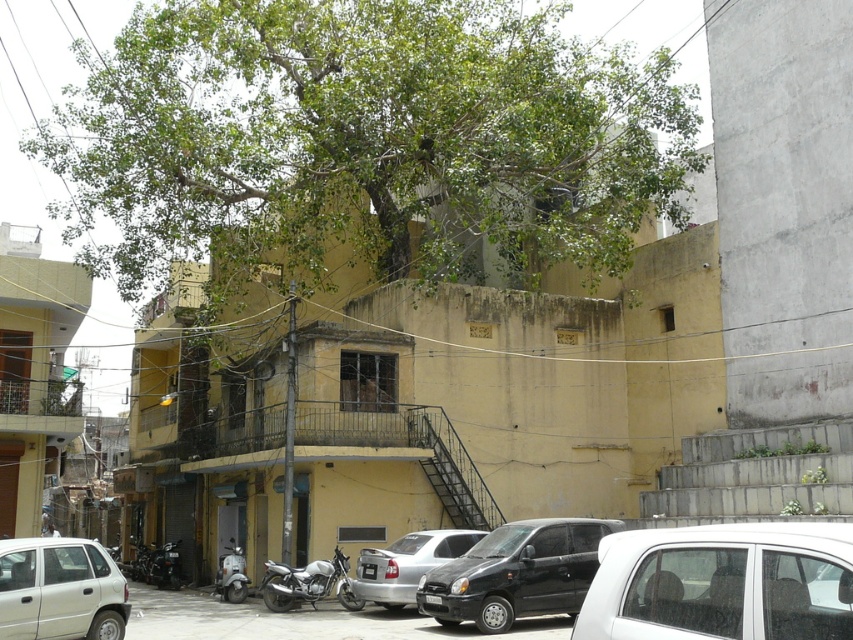
Is point (474, 589) positioned behind point (839, 580)?

Yes, it is behind point (839, 580).

Between matte black car at center and white glossy car at lower right, which one appears on the right side from the viewer's perspective?

matte black car at center is more to the right.

Locate an element on the screen. Image resolution: width=853 pixels, height=640 pixels. matte black car at center is located at coordinates (515, 573).

Describe the element at coordinates (827, 584) in the screenshot. The width and height of the screenshot is (853, 640). I see `white glossy car at lower right` at that location.

Is white glossy car at lower right bigger than metallic silver scooter at lower left?

Incorrect, white glossy car at lower right is not larger than metallic silver scooter at lower left.

Does point (840, 605) come farther from viewer compared to point (227, 600)?

No, it is in front of (227, 600).

The height and width of the screenshot is (640, 853). Identify the location of white glossy car at lower right. (827, 584).

Does point (7, 634) come farther from viewer compared to point (834, 605)?

Yes, it is.

Does white matte suv at lower left have a smaller size compared to white glossy car at lower right?

No, white matte suv at lower left is not smaller than white glossy car at lower right.

Between point (51, 611) and point (833, 600), which one is positioned in front?

Point (833, 600) is more forward.

Find the location of a particular element. The height and width of the screenshot is (640, 853). white matte suv at lower left is located at coordinates (59, 589).